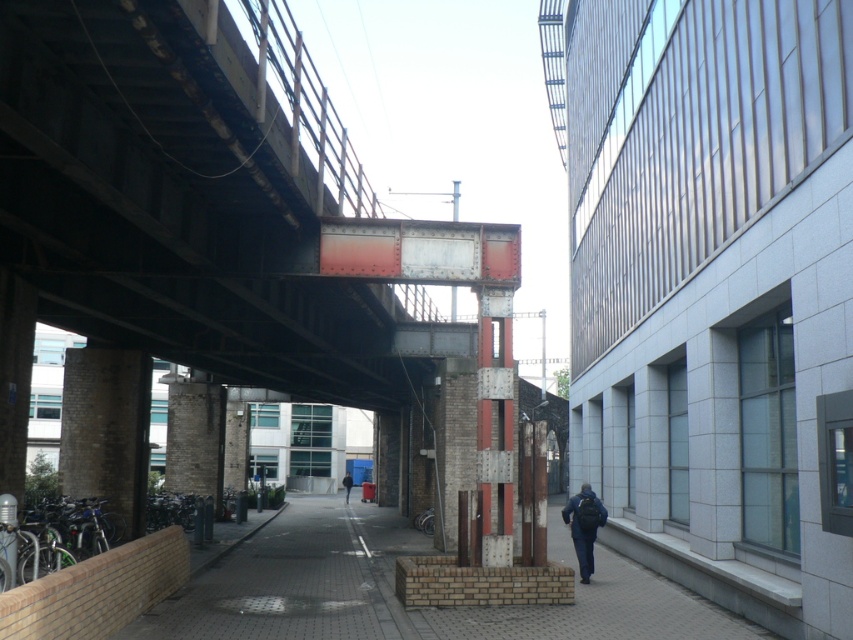
Between dark blue jeans at center and dark blue jacket at center, which one is positioned lower?

Positioned lower is dark blue jacket at center.

Who is more distant from viewer, (x=576, y=550) or (x=346, y=481)?

Positioned behind is point (x=346, y=481).

Locate an element on the screen. This screenshot has height=640, width=853. dark blue jeans at center is located at coordinates (584, 525).

Who is shorter, smooth concrete pavement at center or dark blue jeans at center?

dark blue jeans at center

Who is more distant from viewer, (315, 513) or (579, 492)?

Positioned behind is point (315, 513).

Is point (283, 600) farther from viewer compared to point (573, 502)?

That is False.

Locate an element on the screen. This screenshot has width=853, height=640. smooth concrete pavement at center is located at coordinates (299, 580).

Measure the distance between brick pavement at lower center and camera.

brick pavement at lower center is 9.63 meters away from camera.

Who is positioned more to the right, brick pavement at lower center or dark blue jeans at center?

From the viewer's perspective, dark blue jeans at center appears more on the right side.

Between point (368, 528) and point (584, 570), which one is positioned in front?

Positioned in front is point (584, 570).

Find the location of a particular element. The image size is (853, 640). brick pavement at lower center is located at coordinates (395, 595).